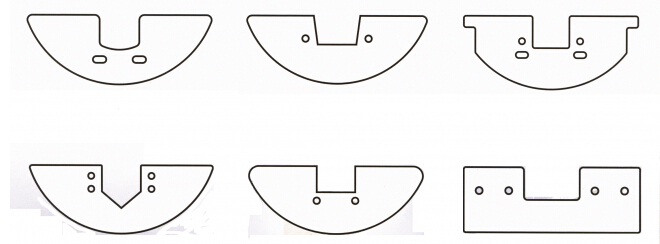
Find the location of a particular element. top left corner bracket is located at coordinates (66, 58).